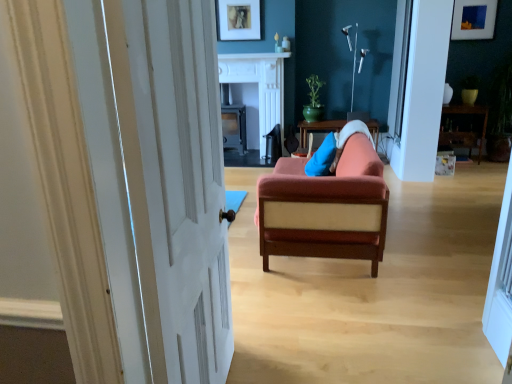
Question: Considering the relative positions of green glossy pot at upper center and wooden table at right, the 1th table in the right-to-left sequence, in the image provided, is green glossy pot at upper center to the left or to the right of wooden table at right, the 1th table in the right-to-left sequence,?

Choices:
 (A) right
 (B) left

Answer: (B)

Question: From the image's perspective, is green glossy pot at upper center above or below wooden table at right, the 1th table in the right-to-left sequence?

Choices:
 (A) above
 (B) below

Answer: (A)

Question: Which object is positioned closest to the wooden table at right, the 1th table in the right-to-left sequence?

Choices:
 (A) white marble fireplace at center
 (B) white marble fireplace at upper center
 (C) green glossy pot at upper center
 (D) velvet orange sofa at center
 (E) matte black fireplace at center, which is the 1th table in left-to-right order

Answer: (C)

Question: Which is farther from the velvet orange sofa at center?

Choices:
 (A) green glossy pot at upper center
 (B) wooden table at right, the 1th table in the right-to-left sequence
 (C) white painted wood door at left
 (D) white marble fireplace at center
 (E) blue fabric pillow at center

Answer: (B)